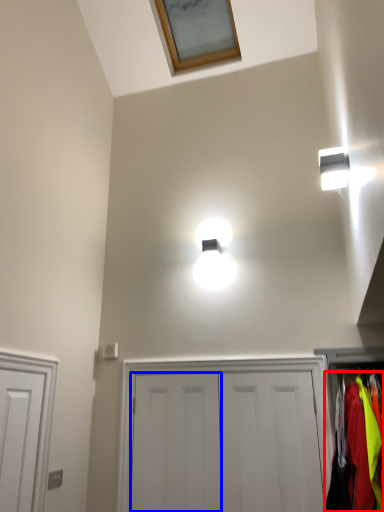
Question: Which of the following is the farthest to the observer, clothing (highlighted by a red box) or door (highlighted by a blue box)?

Choices:
 (A) clothing
 (B) door

Answer: (B)